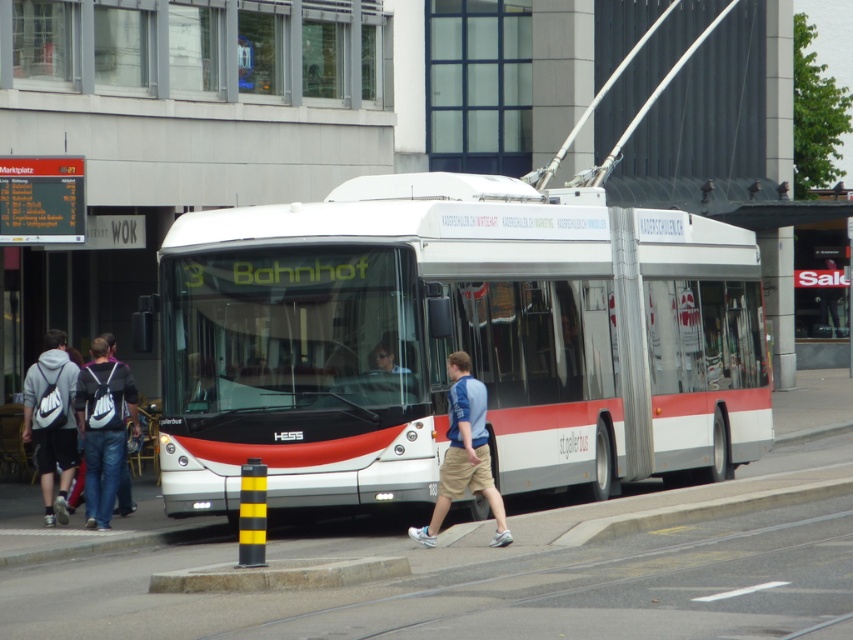
Question: From the image, what is the correct spatial relationship of white metallic bus at center in relation to light blue jersey at center?

Choices:
 (A) below
 (B) above

Answer: (B)

Question: Which point is closer to the camera taking this photo?

Choices:
 (A) (491, 481)
 (B) (679, 380)

Answer: (A)

Question: Which object is positioned farthest from the gray fabric backpack at left?

Choices:
 (A) white metallic bus at center
 (B) white concrete pavement at center

Answer: (B)

Question: Does light blue jersey at center appear on the right side of gray fabric backpack at left?

Choices:
 (A) yes
 (B) no

Answer: (A)

Question: Which point is closer to the camera taking this photo?

Choices:
 (A) (222, 452)
 (B) (73, 467)
 (C) (434, 504)
 (D) (756, 476)

Answer: (C)

Question: Where is white concrete pavement at center located in relation to light blue jersey at center in the image?

Choices:
 (A) left
 (B) right

Answer: (B)